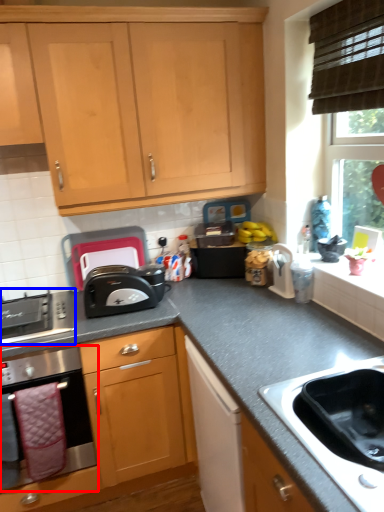
Question: Which of the following is the farthest to the observer, kitchen appliance (highlighted by a red box) or gas stove (highlighted by a blue box)?

Choices:
 (A) kitchen appliance
 (B) gas stove

Answer: (B)